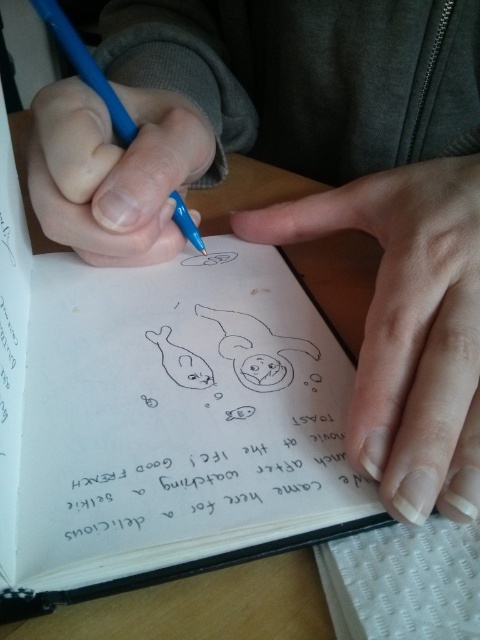
Who is positioned more to the right, nail polish at upper right or matte blue pencil at center?

nail polish at upper right

Who is taller, nail polish at upper right or matte blue pencil at center?

With more height is nail polish at upper right.

Does point (368, 390) come closer to viewer compared to point (204, 248)?

Yes, it is.

Image resolution: width=480 pixels, height=640 pixels. I want to click on nail polish at upper right, so click(x=408, y=326).

Can you confirm if black paper text at center is positioned to the right of white textured notepad at lower right?

No, black paper text at center is not to the right of white textured notepad at lower right.

Is black paper text at center thinner than white textured notepad at lower right?

In fact, black paper text at center might be wider than white textured notepad at lower right.

Does point (141, 512) come in front of point (479, 584)?

No, it is not.

What are the coordinates of `black paper text at center` in the screenshot? It's located at click(204, 474).

Is white textured notepad at lower right smaller than matte blue pencil at center?

No, white textured notepad at lower right is not smaller than matte blue pencil at center.

Locate an element on the screen. Image resolution: width=480 pixels, height=640 pixels. white textured notepad at lower right is located at coordinates (404, 580).

Where is `white textured notepad at lower right`? white textured notepad at lower right is located at coordinates (404, 580).